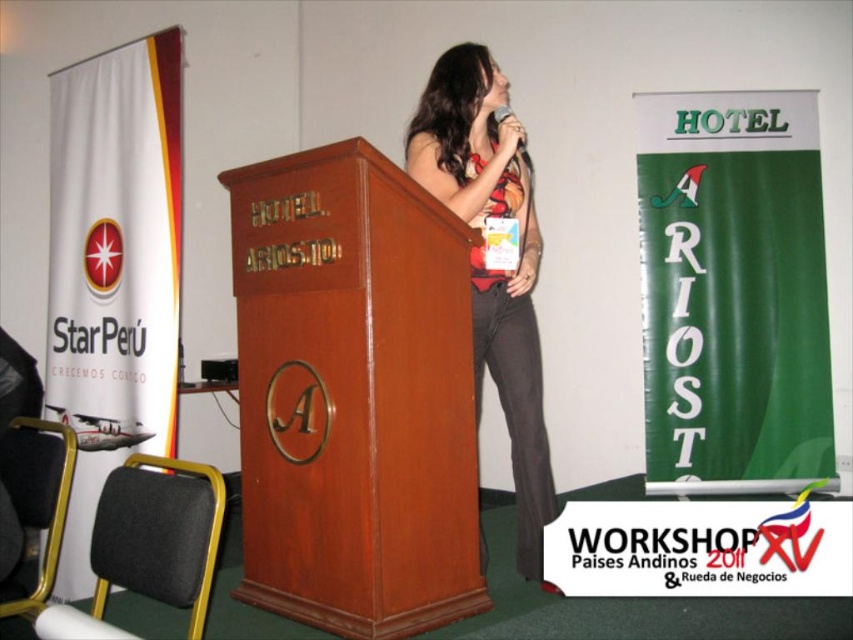
You are an event photographer at the Workshop Paeses Andinos 2011 XV event. You need to capture a photo of the mahogany wood podium at center and the metallic silver microphone at upper center. Based on their positions, which object should you focus on first to ensure both are in frame?

The mahogany wood podium at center is positioned on the left side of the metallic silver microphone at upper center, so you should focus on the metallic silver microphone at upper center first to ensure both objects are within the frame.

You are an attendee at the Workshop Paeses Andinos 2011 XV. You notice the mahogany wood podium at center and the metallic silver microphone at upper center. Which object is closer to you?

The mahogany wood podium at center is closer to you because it is in front of the metallic silver microphone at upper center.